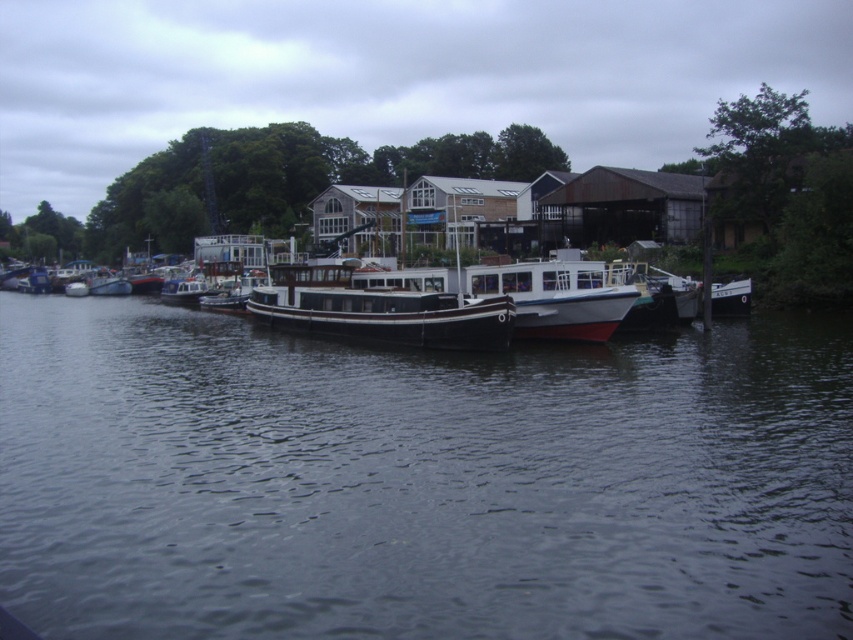
You are standing at the point marked as point (378, 310) in the image. What object are you currently standing on?

You are standing on the black matte houseboat at center as the point (378, 310) corresponds to it.

You are a photographer planning to capture the dark water at center and the black matte houseboat at center in a single shot. Based on their sizes, which object will occupy more of the frame?

The dark water at center has a larger size compared to the black matte houseboat at center, so it will occupy more of the frame.

In the scene shown: You are standing on the riverside dock and see the dark water at center and the black matte houseboat at center. Which object is positioned lower in the scene?

The dark water at center is positioned below the black matte houseboat at center, so the dark water at center is lower in the scene.